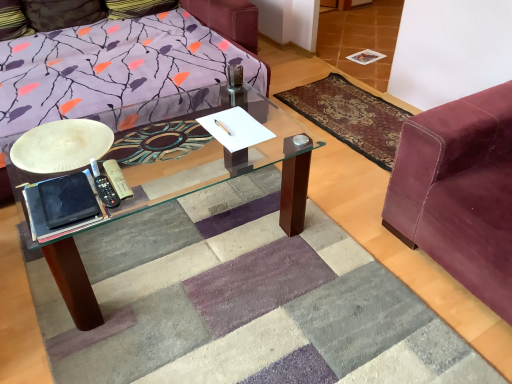
Question: Is the depth of white matte plate at left greater than that of velvet maroon couch at right?

Choices:
 (A) no
 (B) yes

Answer: (B)

Question: Is white matte plate at left at the left side of velvet maroon couch at right?

Choices:
 (A) yes
 (B) no

Answer: (A)

Question: Considering the relative sizes of white matte plate at left and velvet maroon couch at right in the image provided, is white matte plate at left thinner than velvet maroon couch at right?

Choices:
 (A) no
 (B) yes

Answer: (B)

Question: Is white matte plate at left shorter than velvet maroon couch at right?

Choices:
 (A) no
 (B) yes

Answer: (B)

Question: From the image's perspective, would you say white matte plate at left is shown under velvet maroon couch at right?

Choices:
 (A) yes
 (B) no

Answer: (B)

Question: Considering the relative sizes of white matte plate at left and velvet maroon couch at right in the image provided, is white matte plate at left smaller than velvet maroon couch at right?

Choices:
 (A) yes
 (B) no

Answer: (A)

Question: Can you confirm if velvet-like burgundy mat at right is wider than velvet pillow at upper left?

Choices:
 (A) yes
 (B) no

Answer: (A)

Question: Is velvet-like burgundy mat at right next to velvet pillow at upper left?

Choices:
 (A) no
 (B) yes

Answer: (A)

Question: Could velvet pillow at upper left be considered to be inside velvet-like burgundy mat at right?

Choices:
 (A) no
 (B) yes

Answer: (A)

Question: Is velvet-like burgundy mat at right not near velvet pillow at upper left?

Choices:
 (A) no
 (B) yes

Answer: (B)

Question: Is velvet-like burgundy mat at right to the right of velvet pillow at upper left from the viewer's perspective?

Choices:
 (A) yes
 (B) no

Answer: (A)

Question: Does velvet-like burgundy mat at right appear on the left side of velvet pillow at upper left?

Choices:
 (A) yes
 (B) no

Answer: (B)

Question: From a real-world perspective, is velvet pillow at upper left beneath velvet maroon couch at right?

Choices:
 (A) no
 (B) yes

Answer: (A)